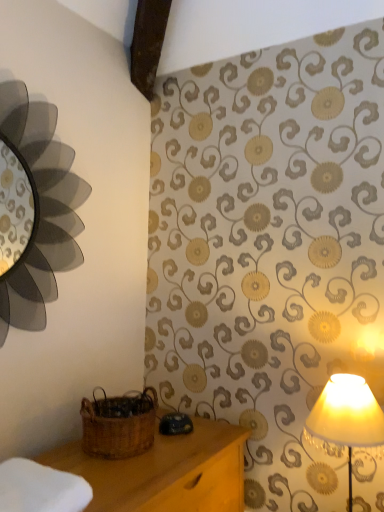
Question: From the image's perspective, is white soft cloth at lower left located above or below woven brown basket at lower left?

Choices:
 (A) below
 (B) above

Answer: (A)

Question: Which is correct: white soft cloth at lower left is inside woven brown basket at lower left, or outside of it?

Choices:
 (A) outside
 (B) inside

Answer: (A)

Question: Based on their relative distances, which object is nearer to the woven brown basket at lower left?

Choices:
 (A) white soft cloth at lower left
 (B) matte cream lampshade at right

Answer: (A)

Question: Estimate the real-world distances between objects in this image. Which object is farther from the white soft cloth at lower left?

Choices:
 (A) matte cream lampshade at right
 (B) woven brown basket at lower left

Answer: (A)